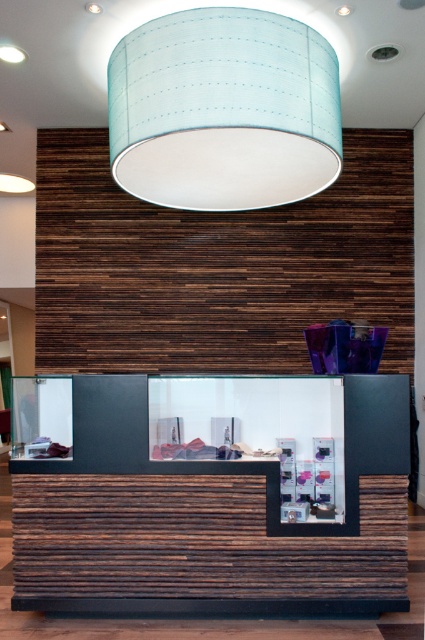
Question: Can you confirm if light blue fabric lampshade at upper center is positioned below wooden reception desk at center?

Choices:
 (A) no
 (B) yes

Answer: (A)

Question: From the image, what is the correct spatial relationship of light blue fabric lampshade at upper center in relation to wooden reception desk at center?

Choices:
 (A) left
 (B) right

Answer: (B)

Question: Can you confirm if light blue fabric lampshade at upper center is bigger than wooden reception desk at center?

Choices:
 (A) yes
 (B) no

Answer: (A)

Question: Which point appears farthest from the camera in this image?

Choices:
 (A) (268, 204)
 (B) (374, 397)

Answer: (A)

Question: Which point is closer to the camera taking this photo?

Choices:
 (A) (268, 33)
 (B) (362, 396)

Answer: (B)